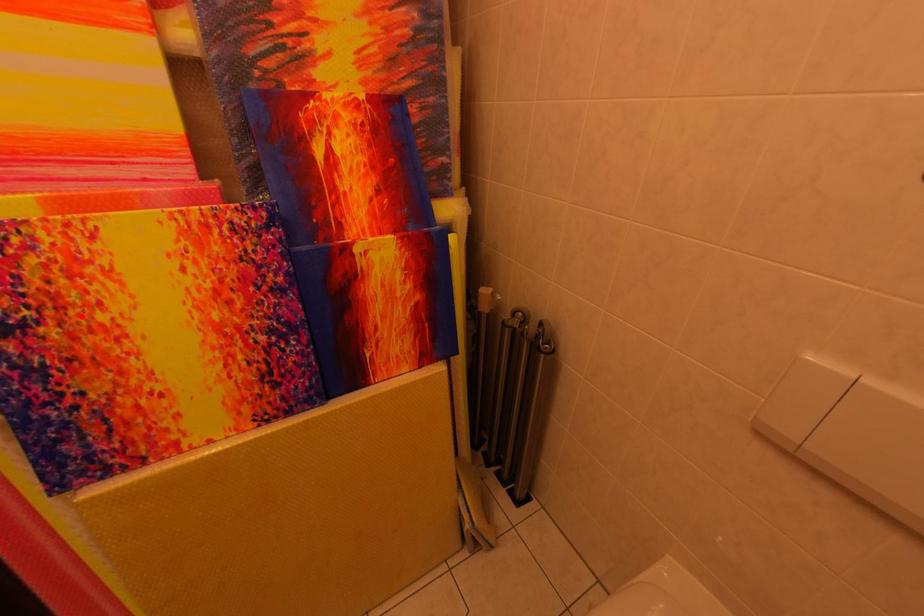
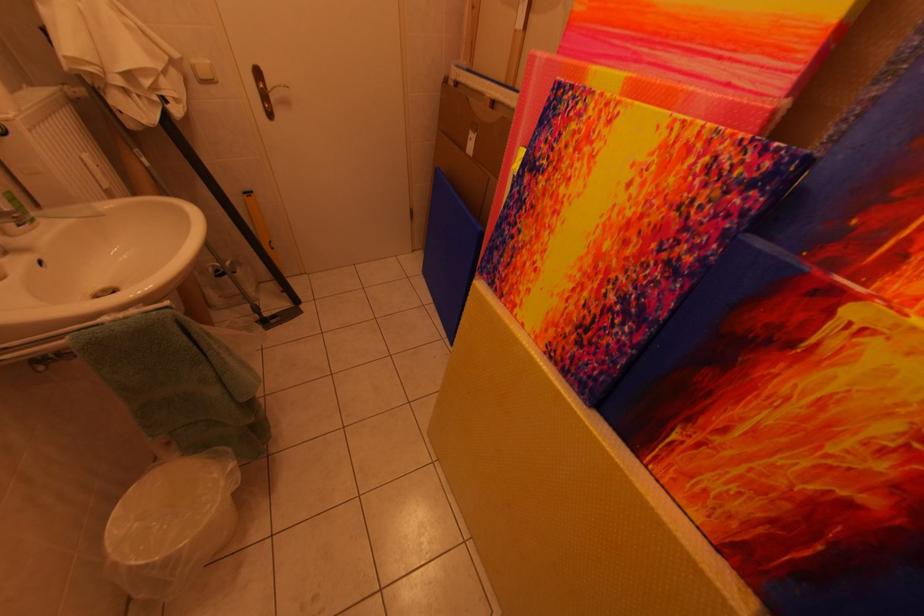
In the second image, find the point that corresponds to the highlighted location in the first image.

(565, 180)